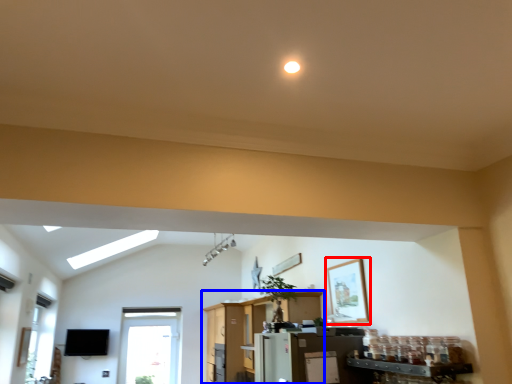
Question: Among these objects, which one is nearest to the camera, picture frame (highlighted by a red box) or entertainment center (highlighted by a blue box)?

Choices:
 (A) picture frame
 (B) entertainment center

Answer: (A)